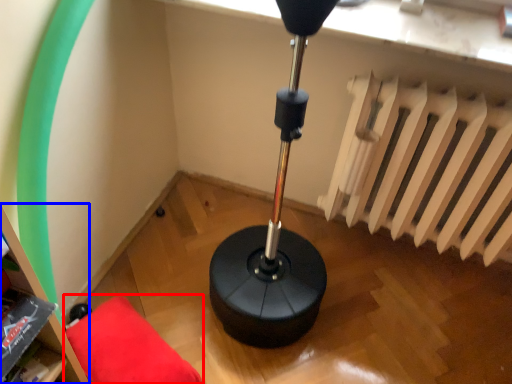
Question: Which of the following is the closest to the observer, furniture (highlighted by a red box) or bookshelf (highlighted by a blue box)?

Choices:
 (A) furniture
 (B) bookshelf

Answer: (B)